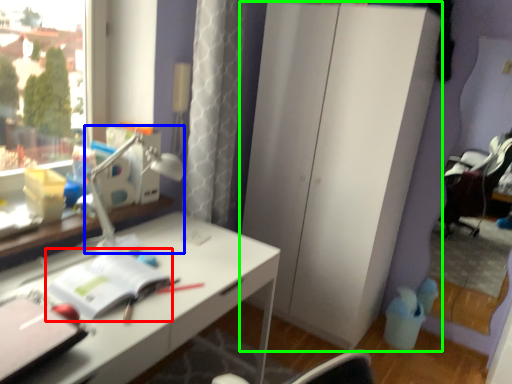
Question: Which is farther away from notebook (highlighted by a red box)? table lamp (highlighted by a blue box) or dresser (highlighted by a green box)?

Choices:
 (A) table lamp
 (B) dresser

Answer: (B)